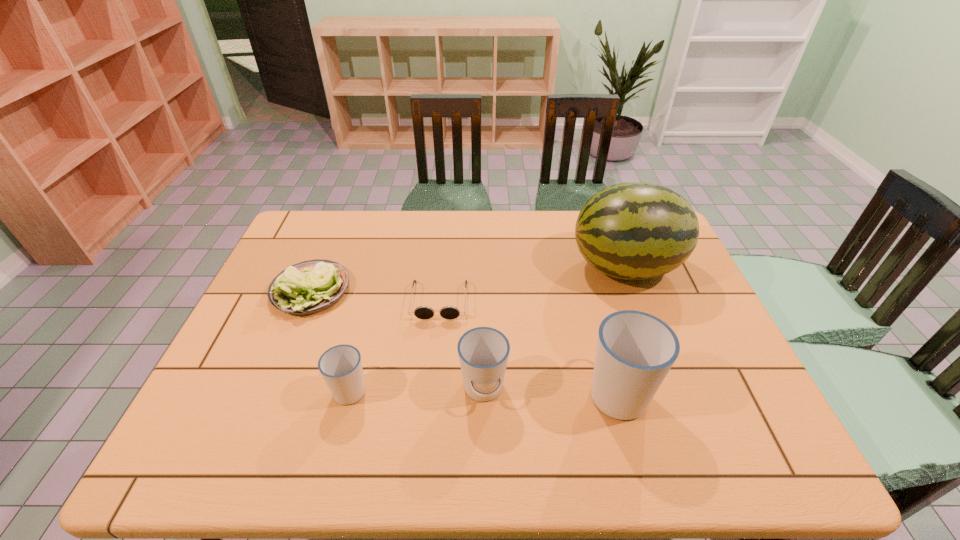
Locate an element on the screen. the leftmost cup is located at coordinates (341, 367).

Identify the location of the fourth tallest object. The width and height of the screenshot is (960, 540). (341, 367).

Locate an element on the screen. the fourth shortest object is located at coordinates (483, 352).

Where is `the second shortest cup`? the second shortest cup is located at coordinates (483, 352).

The height and width of the screenshot is (540, 960). What are the coordinates of `the rightmost cup` in the screenshot? It's located at (635, 350).

Locate an element on the screen. Image resolution: width=960 pixels, height=540 pixels. the tallest cup is located at coordinates (635, 350).

I want to click on sunglasses, so click(x=422, y=312).

This screenshot has width=960, height=540. What are the coordinates of `the tallest object` in the screenshot? It's located at (635, 230).

At what (x,y) coordinates should I click in order to perform the action: click on the leftmost object. Please return your answer as a coordinate pair (x, y). The height and width of the screenshot is (540, 960). Looking at the image, I should click on (309, 287).

You are a GUI agent. You are given a task and a screenshot of the screen. Output one action in this format:
    pyautogui.click(x=<x>, y=<y>)
    Task: Click on the lettuce
    This screenshot has width=960, height=540.
    Given the screenshot: What is the action you would take?
    pyautogui.click(x=309, y=287)